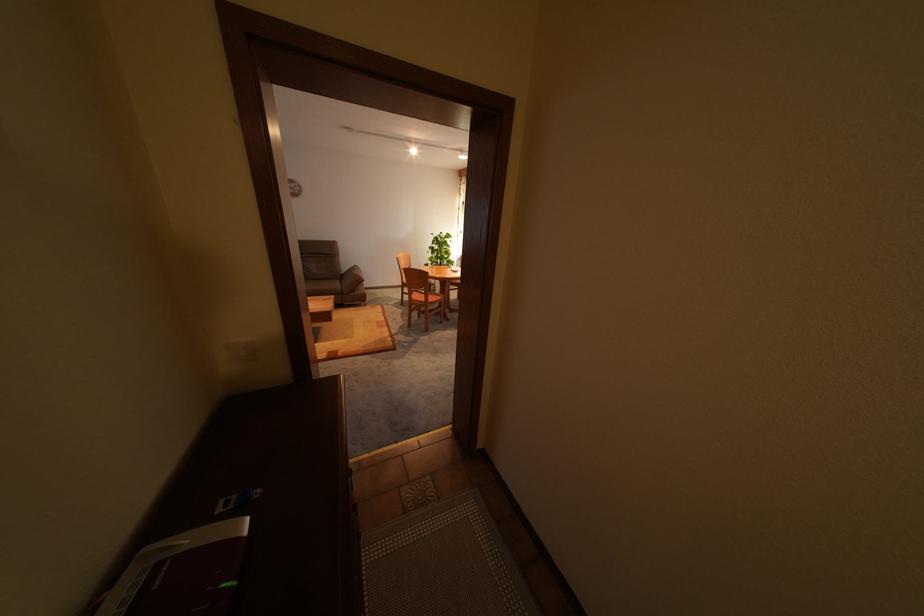
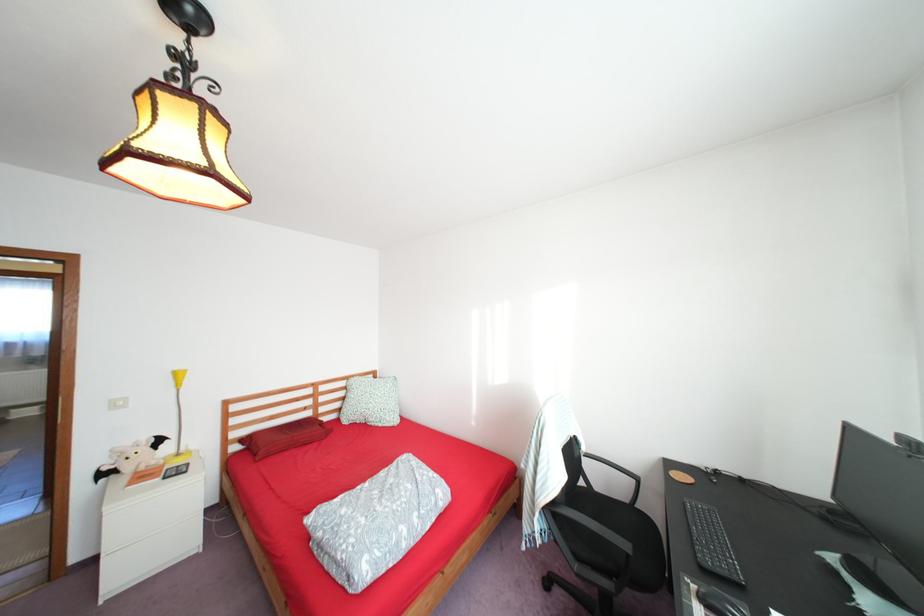
Question: I am providing you with two images of the same scene from different viewpoints. Please identify which objects are invisible in image2.

Choices:
 (A) brown sofa armrest
 (B) white light switch
 (C) patterned square pillow
 (D) closed laptop

Answer: (A)